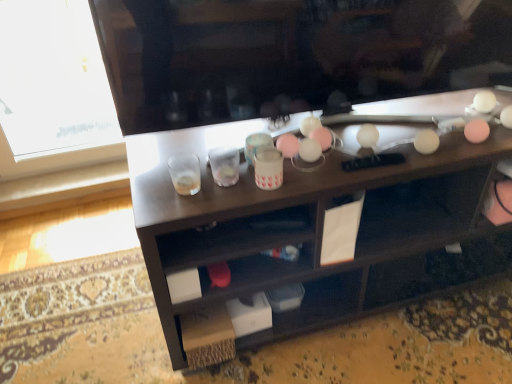
This screenshot has height=384, width=512. Identify the location of unoccupied region to the right of translucent glass at center, which ranks as the second shot glass in right-to-left order. (245, 186).